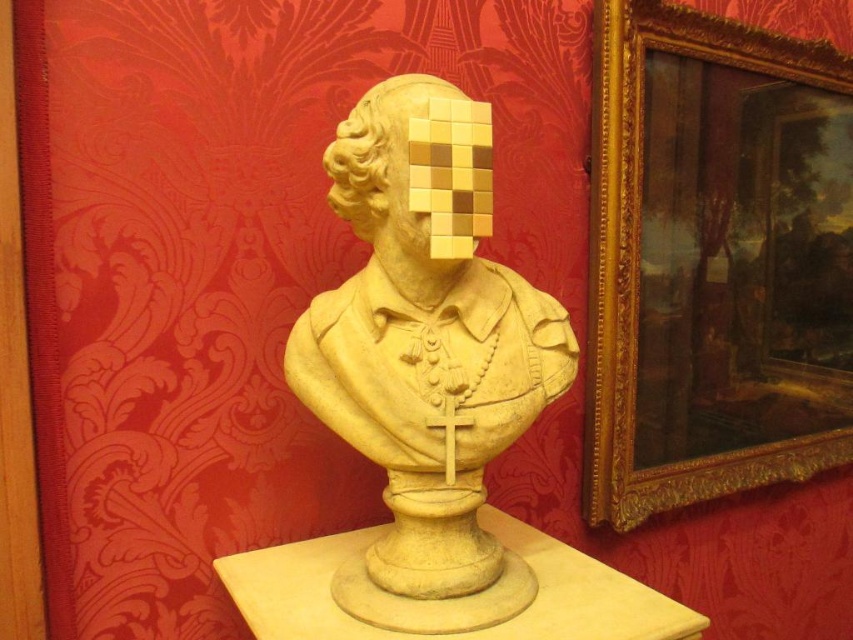
Which is below, gold ornate frame at upper right or beige stone bust at center?

gold ornate frame at upper right

Is gold ornate frame at upper right smaller than beige stone bust at center?

No.

Who is more distant from viewer, (x=705, y=451) or (x=409, y=129)?

The point (x=705, y=451) is behind.

Where is `gold ornate frame at upper right`? Image resolution: width=853 pixels, height=640 pixels. gold ornate frame at upper right is located at coordinates (715, 259).

Which is above, gold ornate frame at upper right or matte stone bust at center?

Positioned higher is gold ornate frame at upper right.

Does point (804, 136) lie behind point (416, 609)?

Yes, point (804, 136) is farther from viewer.

You are a GUI agent. You are given a task and a screenshot of the screen. Output one action in this format:
    pyautogui.click(x=<x>, y=<y>)
    Task: Click on the gold ornate frame at upper right
    This screenshot has width=853, height=640.
    Given the screenshot: What is the action you would take?
    pyautogui.click(x=715, y=259)

Find the location of `gold ornate frame at upper right`. gold ornate frame at upper right is located at coordinates (715, 259).

Does matte stone bust at center lie in front of beige stone bust at center?

No, it is behind beige stone bust at center.

Which is more to the left, matte stone bust at center or beige stone bust at center?

beige stone bust at center is more to the left.

Is point (531, 419) positioned in front of point (440, 90)?

No.

Identify the location of matte stone bust at center. The width and height of the screenshot is (853, 640). (422, 381).